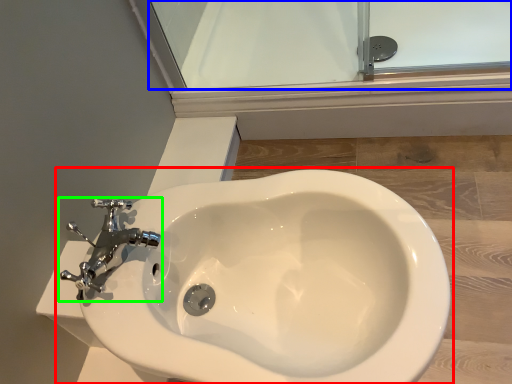
Question: Considering the real-world distances, which object is closest to toilet (highlighted by a red box)? glass door (highlighted by a blue box) or tap (highlighted by a green box).

Choices:
 (A) glass door
 (B) tap

Answer: (B)